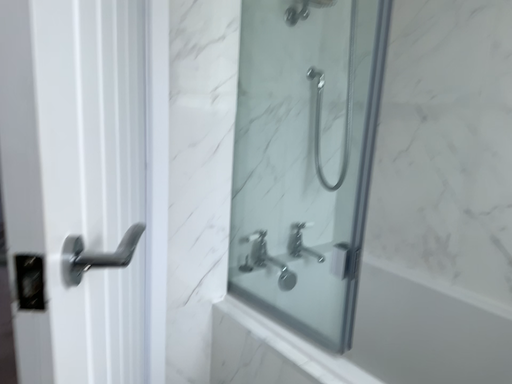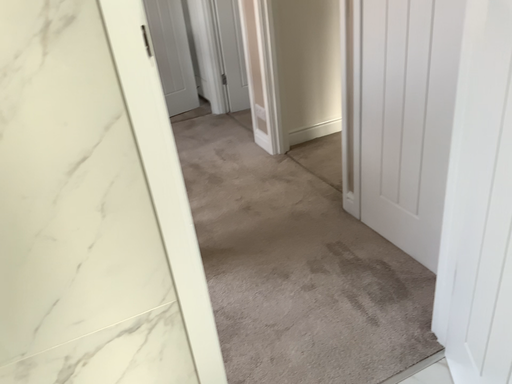
Question: Which way did the camera rotate in the video?

Choices:
 (A) rotated right
 (B) rotated left

Answer: (B)